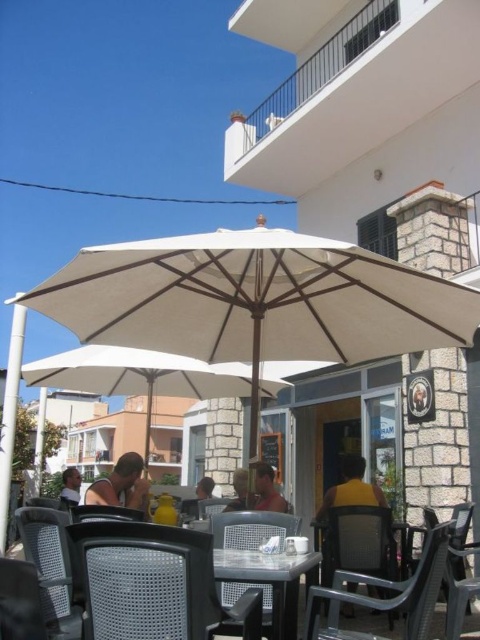
Question: Which object is positioned farthest from the black mesh chair at lower left?

Choices:
 (A) beige fabric umbrella at center
 (B) white fabric umbrella at center

Answer: (B)

Question: Considering the relative positions of beige fabric umbrella at center and matte pink shirt at center in the image provided, where is beige fabric umbrella at center located with respect to matte pink shirt at center?

Choices:
 (A) right
 (B) left

Answer: (B)

Question: Estimate the real-world distances between objects in this image. Which object is farther from the matte yellow shirt at center?

Choices:
 (A) matte plastic chair at center
 (B) light brown hair at lower left
 (C) white fabric umbrella at center

Answer: (B)

Question: Which point is closer to the camera taking this photo?

Choices:
 (A) (203, 500)
 (B) (99, 516)
 (C) (66, 518)
 (D) (242, 493)

Answer: (C)

Question: Can you confirm if matte black shirt at lower left is smaller than brown leather jacket at center?

Choices:
 (A) no
 (B) yes

Answer: (A)

Question: From the image, what is the correct spatial relationship of black plastic chair at lower left in relation to brown leather jacket at center?

Choices:
 (A) below
 (B) above

Answer: (B)